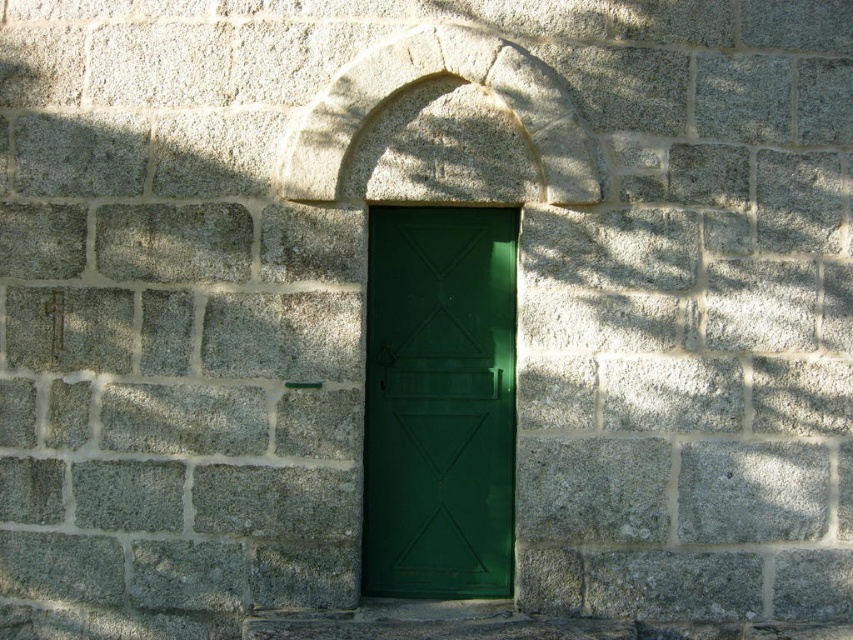
Does green matte door at center appear on the left side of gray stone arch at center?

No, green matte door at center is not to the left of gray stone arch at center.

Locate an element on the screen. green matte door at center is located at coordinates (439, 403).

I want to click on green matte door at center, so click(439, 403).